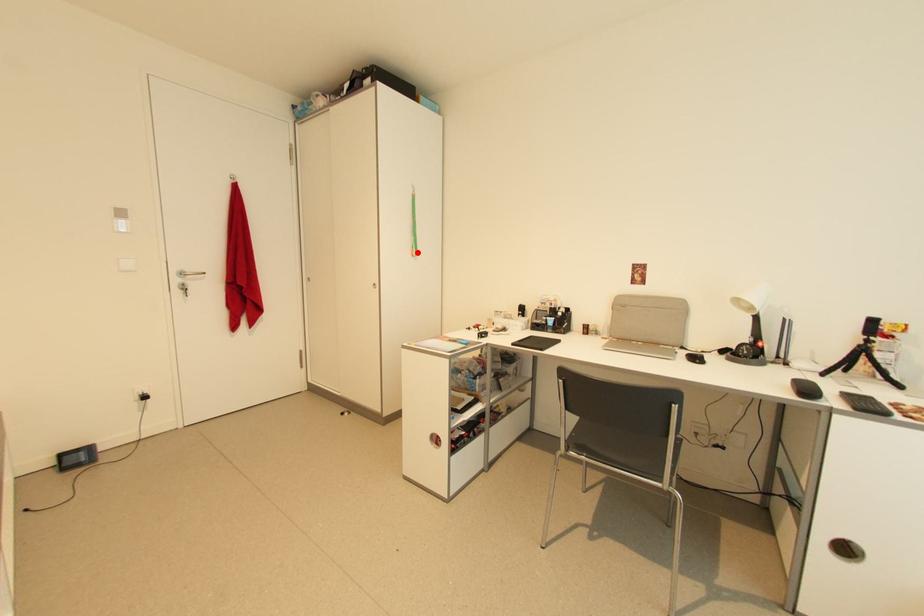
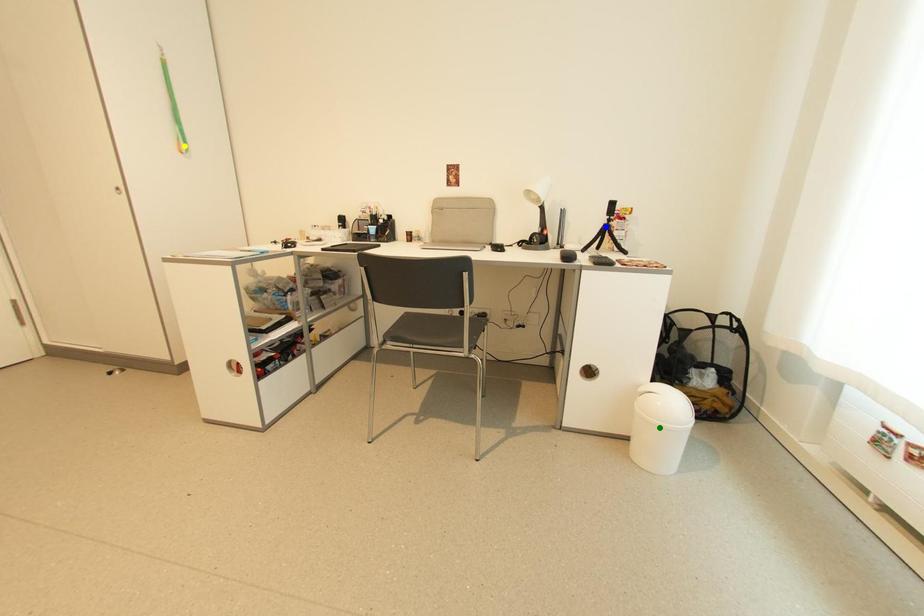
Question: I am providing you with two images of the same scene from different viewpoints. A red point is marked on the first image. You are given multiple points on the second image. Which point in image 2 represents the same 3d spot as the red point in image 1?

Choices:
 (A) blue point
 (B) yellow point
 (C) green point

Answer: (B)